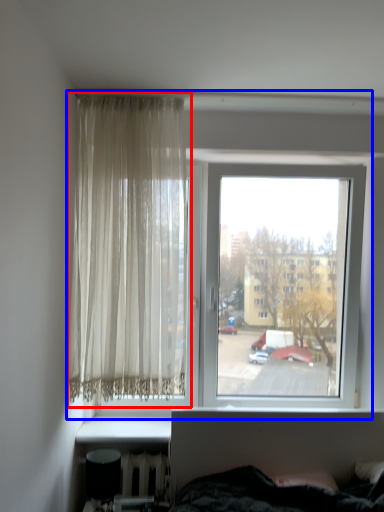
Question: Which of the following is the farthest to the observer, curtain (highlighted by a red box) or window (highlighted by a blue box)?

Choices:
 (A) curtain
 (B) window

Answer: (B)